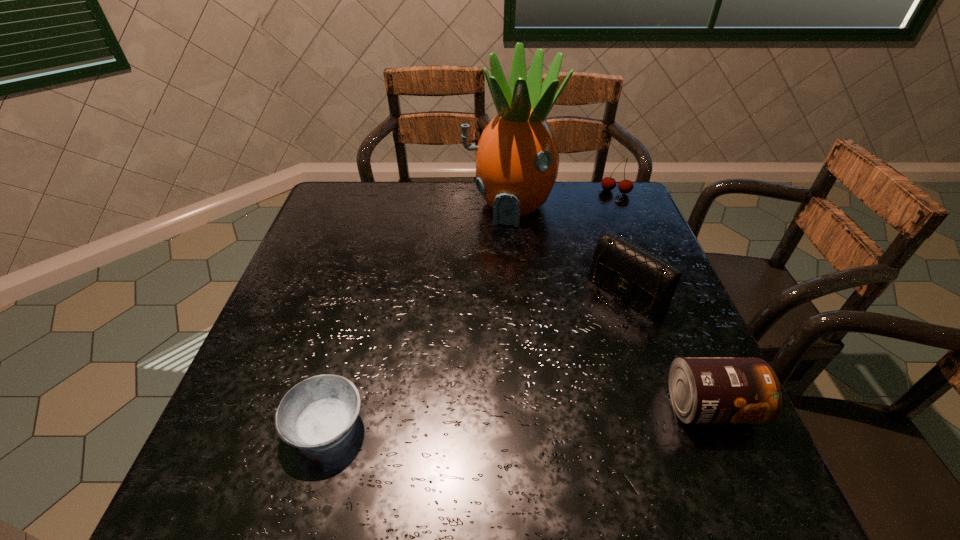
Identify the location of can that is at the near edge. The height and width of the screenshot is (540, 960). (703, 390).

Identify the location of object present at the left edge. (x=318, y=413).

Find the location of a particular element. The height and width of the screenshot is (540, 960). can at the right edge is located at coordinates (703, 390).

Identify the location of cherry present at the right edge. (625, 186).

What are the coordinates of `clutch bag situated at the right edge` in the screenshot? It's located at (645, 282).

You are a GUI agent. You are given a task and a screenshot of the screen. Output one action in this format:
    pyautogui.click(x=<x>, y=<y>)
    Task: Click on the object present at the near left corner
    
    Given the screenshot: What is the action you would take?
    pyautogui.click(x=318, y=413)

Where is `object at the far right corner`? This screenshot has width=960, height=540. object at the far right corner is located at coordinates (625, 186).

Find the location of a particular element. The height and width of the screenshot is (540, 960). object present at the near right corner is located at coordinates (703, 390).

Locate an element on the screen. vacant region at the far edge of the desktop is located at coordinates (558, 214).

What are the coordinates of `vacant point at the near edge` in the screenshot? It's located at (617, 441).